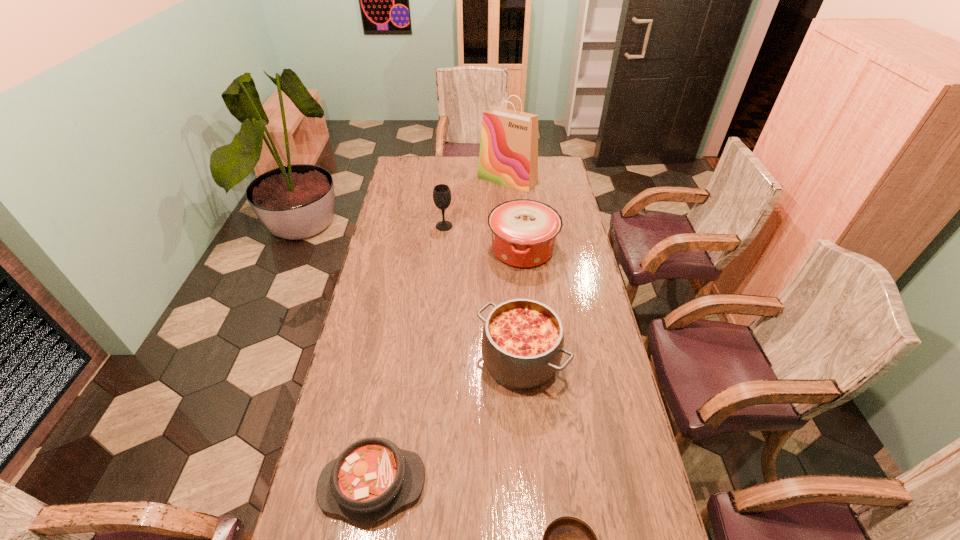
What are the coordinates of `free region at the far right corner of the desktop` in the screenshot? It's located at (561, 161).

Identify the location of free space between the farthest casserole and the fifth tallest object. This screenshot has width=960, height=540. (447, 367).

Locate an element on the screen. free space that is in between the farthest object and the fifth tallest object is located at coordinates (440, 332).

Identify the location of free spot between the leftmost casserole and the wineglass. (408, 355).

Where is `vacant area that lies between the farthest object and the second nearest casserole`? vacant area that lies between the farthest object and the second nearest casserole is located at coordinates (514, 270).

Where is `the closest object relative to the tallest object`? the closest object relative to the tallest object is located at coordinates (441, 194).

Where is `object that is the fifth closest one to the third nearest object`? The width and height of the screenshot is (960, 540). object that is the fifth closest one to the third nearest object is located at coordinates (508, 155).

Where is `casserole that is the nearest to the shortest casserole`? This screenshot has width=960, height=540. casserole that is the nearest to the shortest casserole is located at coordinates (522, 344).

Identify the location of casserole that is the second nearest to the shortest object. This screenshot has height=540, width=960. (522, 344).

Locate an element on the screen. This screenshot has width=960, height=540. vacant space that satisfies the following two spatial constraints: 1. on the back side of the third nearest object; 2. on the right side of the tallest object is located at coordinates (506, 179).